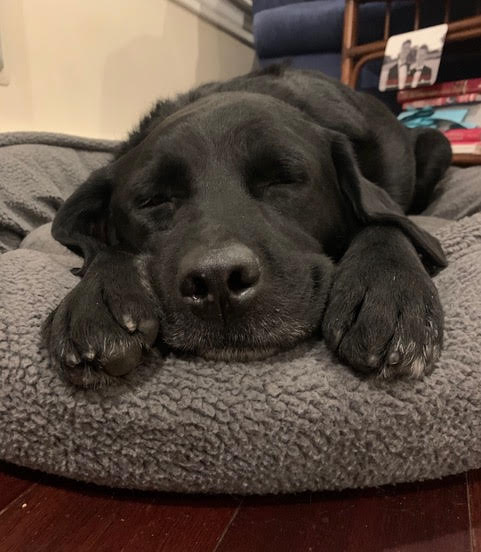
In order to click on books in this screenshot , I will do click(x=462, y=82), click(x=463, y=94), click(x=461, y=136).